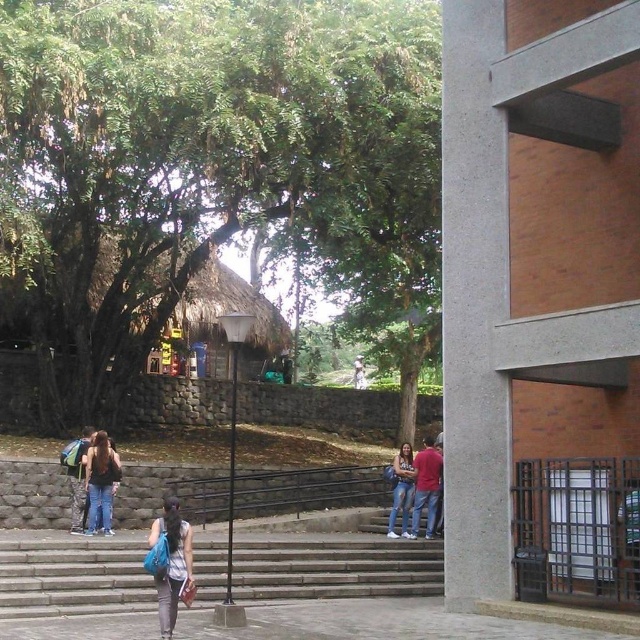
You are a delivery person with a 10 meter long rope. You need to secure the matte blue backpack at lower left to the thatched roof hut at center. Is the rope long enough?

The thatched roof hut at center is 10.87 meters from the matte blue backpack at lower left. Since the rope is only 10 meters long, it is not long enough to reach between them.

You are a delivery robot with a 12 inch wide package. You need to move from the starting point to the destination, passing between the denim jacket at lower left and the matte blue backpack at lower left. Can you fit through the space between them?

The distance between the denim jacket at lower left and the matte blue backpack at lower left is 14.42 inches. Since your package is 12 inches wide, it can fit through the space between them as the available space is wider than the package.